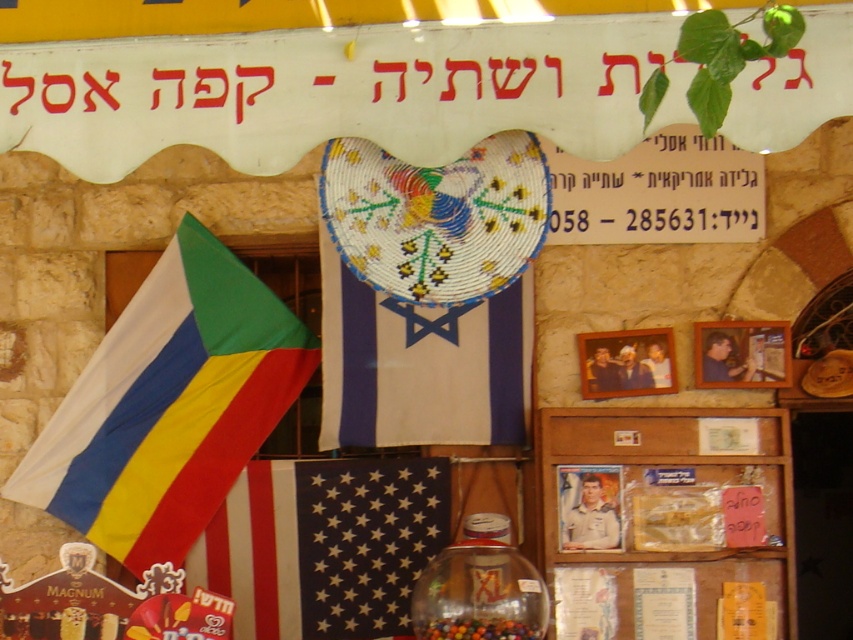
You are a customer in the store and want to place a small decorative item between the white fabric flag at center and the shiny plastic beads at center. Where should you place it to be centered between them?

The white fabric flag at center is positioned on the left side of shiny plastic beads at center, so placing the item between them would require placing it to the right of the white fabric flag at center and to the left of the shiny plastic beads at center to be centered between them.

You are standing in front of the display of flags and memorabilia at Kafe Assaf. There are two points marked on the display. Which point is closer to you, point (397,621) or point (454,637)?

Point (397,621) is closer to you because it is further to the viewer than point (454,637).

You are a customer in the store and want to see the multicolored fabric flag at left clearly. Can you see it fully without moving the beaded fabric flag at center?

The beaded fabric flag at center is in front of the multicolored fabric flag at left, so you cannot see the multicolored fabric flag at left fully without moving the beaded fabric flag at center.